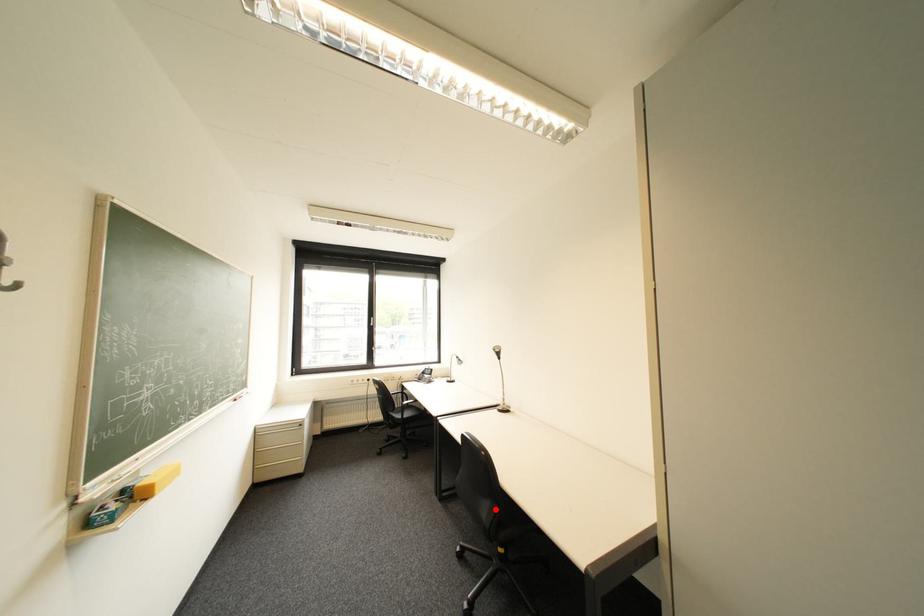
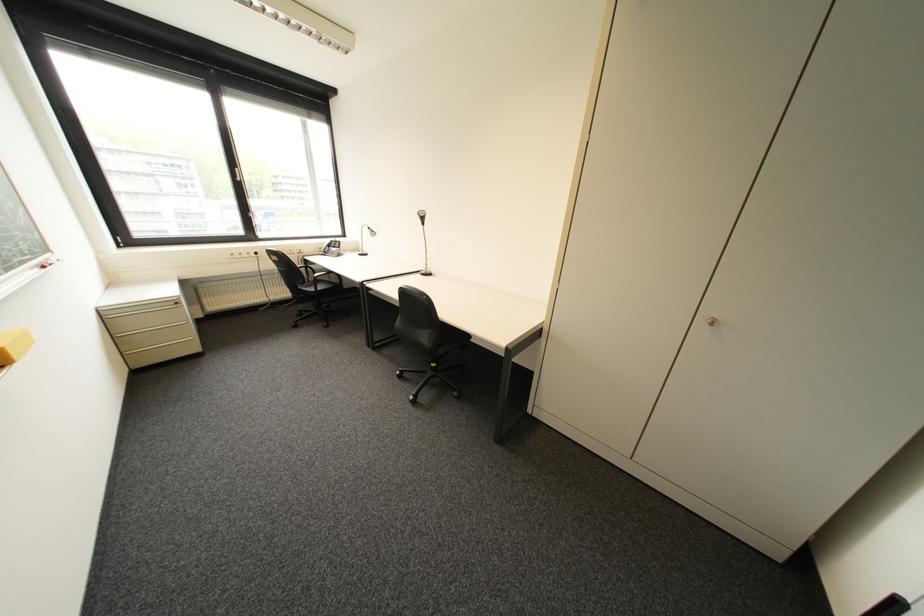
In the second image, find the point that corresponds to the highlighted location in the first image.

(435, 338)